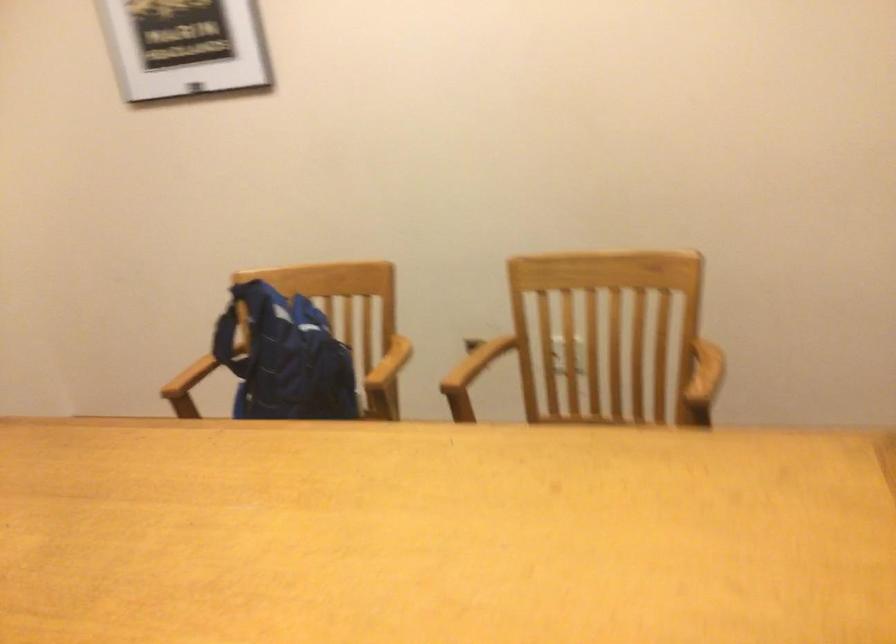
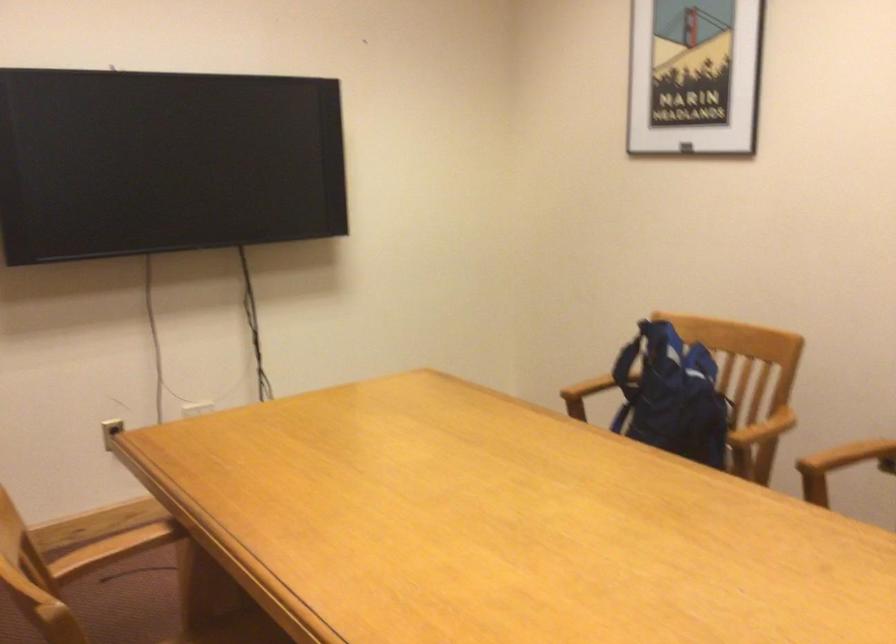
Locate, in the second image, the point that corresponds to pixel 194 371 in the first image.

(586, 388)